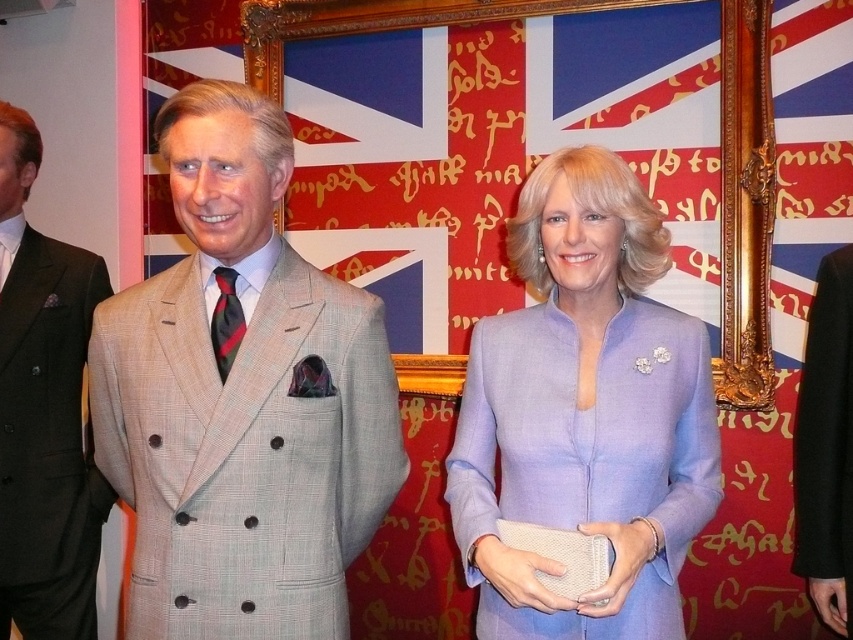
You are a photographer at the event and need to position two subjects so that the black wool suit at right is visible in the reflection of the gold ornate picture frame at center. Is the current arrangement allowing this?

The gold ornate picture frame at center is to the left of the black wool suit at right. Since the frame is positioned to the left of the suit, the reflection in the frame would show the area to its right, which includes the black wool suit at right. Therefore, the current arrangement allows the black wool suit at right to be visible in the reflection of the gold ornate picture frame at center.